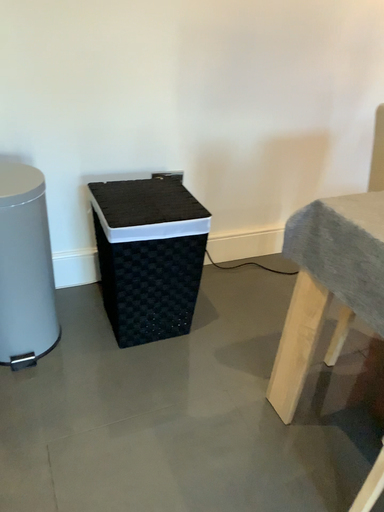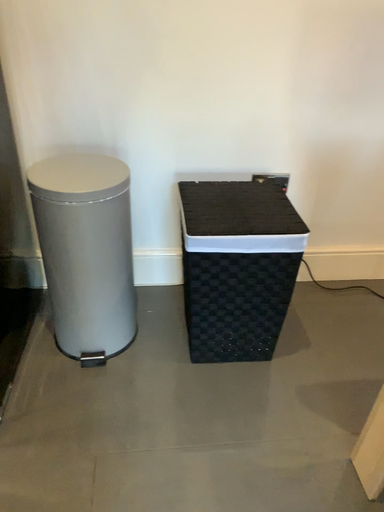
Question: Which way did the camera rotate in the video?

Choices:
 (A) rotated left
 (B) rotated right

Answer: (A)